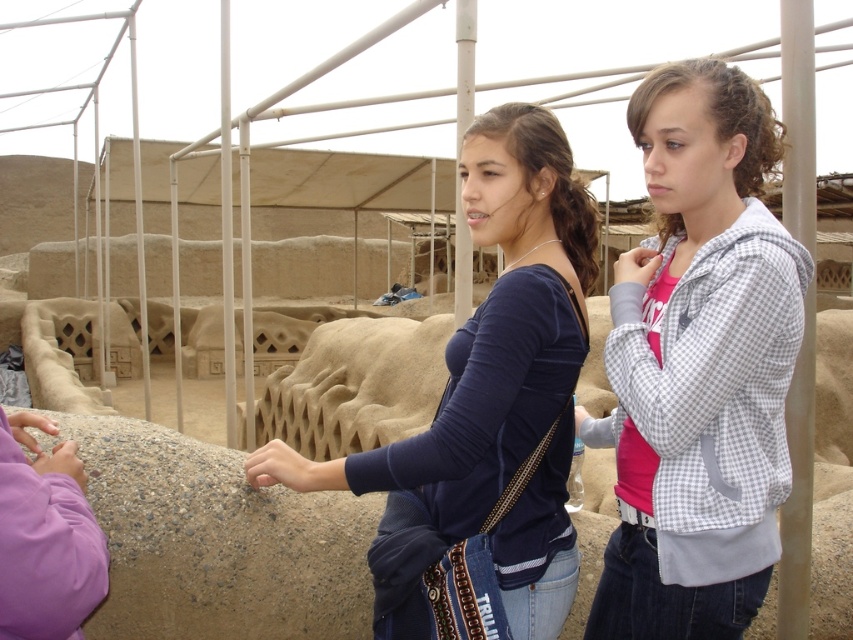
Does white checkered jacket at center appear on the left side of dark blue jersey at center?

Incorrect, white checkered jacket at center is not on the left side of dark blue jersey at center.

Where is `white checkered jacket at center`? The width and height of the screenshot is (853, 640). white checkered jacket at center is located at coordinates (698, 365).